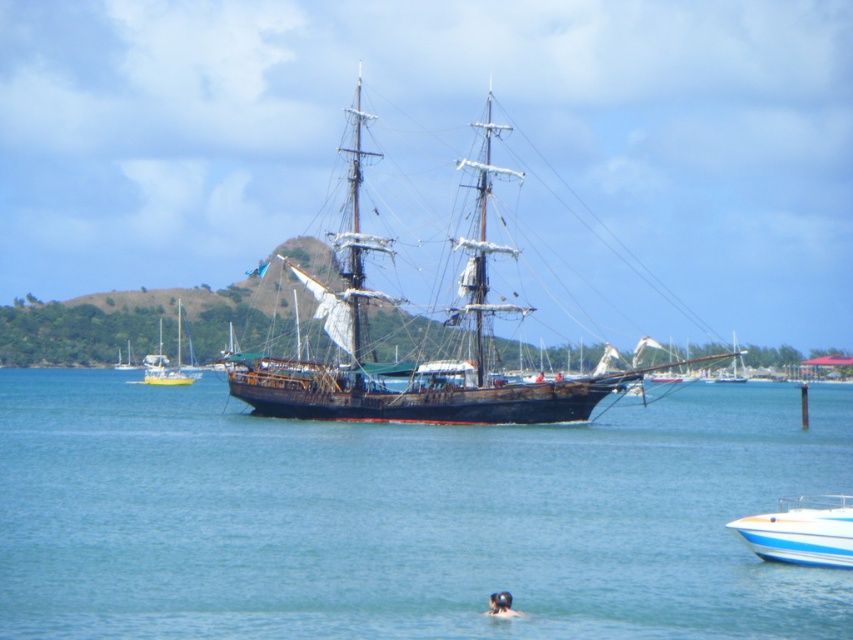
Question: Is blue water at center below rusty wooden ship at center?

Choices:
 (A) no
 (B) yes

Answer: (B)

Question: Which object appears closest to the camera in this image?

Choices:
 (A) blue water at center
 (B) yellow plastic sailboat at left
 (C) rusty wooden ship at center

Answer: (A)

Question: Considering the real-world distances, which object is farthest from the blue glossy speedboat at lower right?

Choices:
 (A) rusty wooden ship at center
 (B) blurred skin head at lower center

Answer: (A)

Question: Does yellow plastic sailboat at left have a larger size compared to blurred skin head at lower center?

Choices:
 (A) no
 (B) yes

Answer: (B)

Question: Observing the image, what is the correct spatial positioning of rusty wooden ship at center in reference to blurred skin head at lower center?

Choices:
 (A) right
 (B) left

Answer: (B)

Question: Which point appears closest to the camera in this image?

Choices:
 (A) (514, 616)
 (B) (776, 548)
 (C) (405, 362)

Answer: (A)